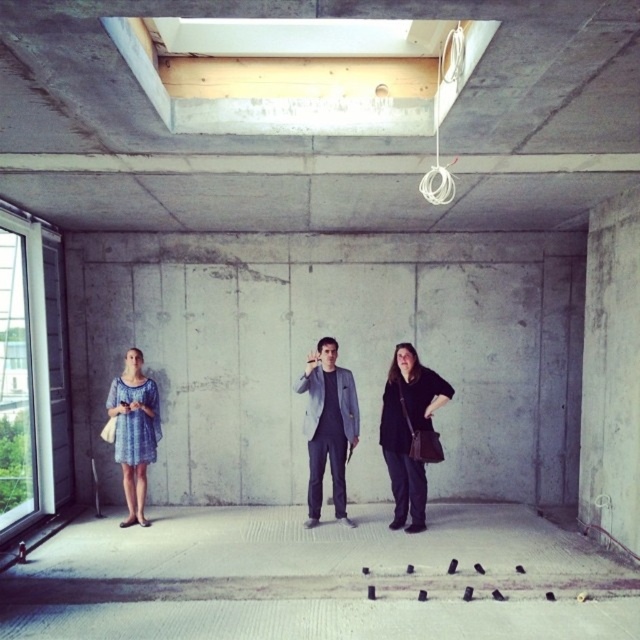
You are a delivery person who needs to place a small package on the floor near the blue printed dress at left without disturbing the black leather jacket at lower right. Is this possible?

The black leather jacket at lower right is above the blue printed dress at left, so placing the package near the blue printed dress at left on the floor would not disturb the jacket since it is elevated.

You are a fashion designer observing the construction site and need to decide which garment to recommend for a photoshoot. Considering the space, which item has a wider silhouette between the black leather jacket at lower right and the gray fabric suit at center?

The black leather jacket at lower right has a wider silhouette than the gray fabric suit at center since its width surpasses the suit.